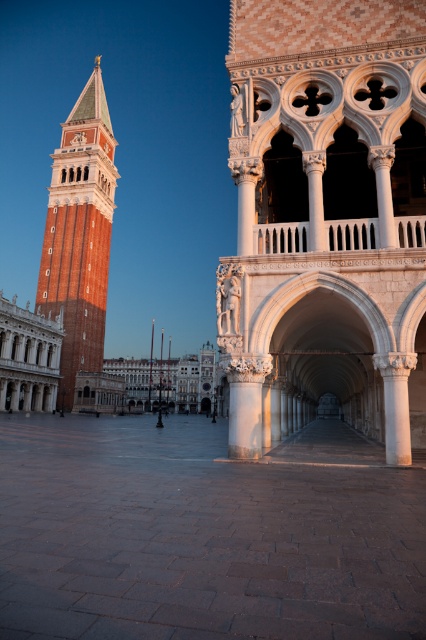
You are a tourist standing in St. Mark Square and want to take a photo that includes both the white marble palace at left and the white marble palace at center. Which palace should you position closer to in order to capture both in the frame?

To capture both the white marble palace at left and the white marble palace at center in the frame, you should position yourself closer to the white marble palace at left since it is shorter than the white marble palace at center, allowing both to be visible within the camera view.

Based on the provided scene description, can you determine the exact 2D coordinates of the white stone archway at center?

The white stone archway at center is located at the 2D coordinates of point (325, 220).

You are standing in St. Mark Square and want to take a photo of both the Campanile di San Marco and the Doge Palace. You have two points marked on your map as reference points for the best angles. The first point is at coordinate point (85, 116) and the second is at point (173, 371). Which point should you choose to ensure both landmarks are fully visible in your photo?

You should choose point (85, 116) because it is closer to the viewer, allowing both the Campanile di San Marco on the left and the Doge Palace on the right to be fully visible in the frame.